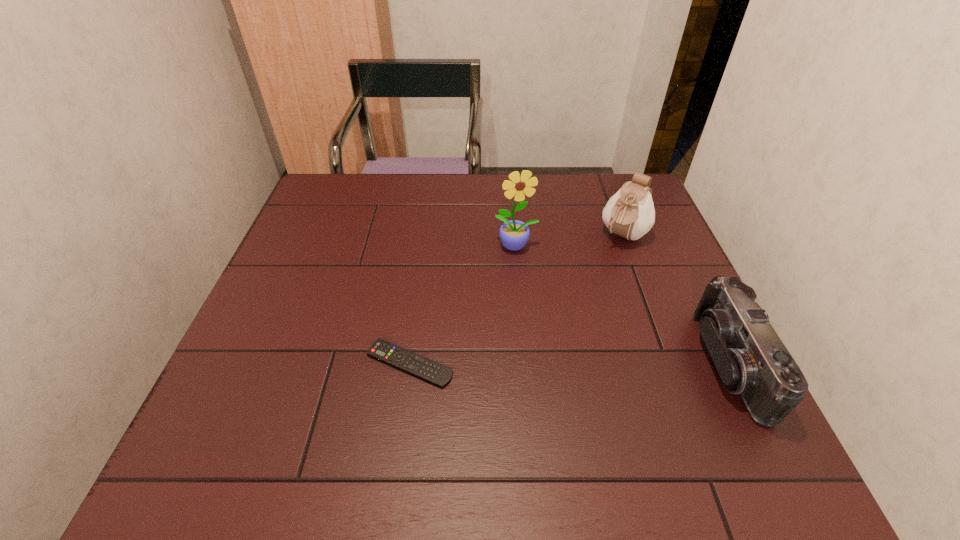
Where is `free space on the desktop that is between the remote control and the camcorder and is positioned on the front-facing side of the second tallest object`? This screenshot has width=960, height=540. free space on the desktop that is between the remote control and the camcorder and is positioned on the front-facing side of the second tallest object is located at coordinates (529, 363).

Find the location of `vacant spot on the desktop that is between the leftmost object and the camcorder and is positioned on the front-facing side of the tallest object`. vacant spot on the desktop that is between the leftmost object and the camcorder and is positioned on the front-facing side of the tallest object is located at coordinates click(552, 363).